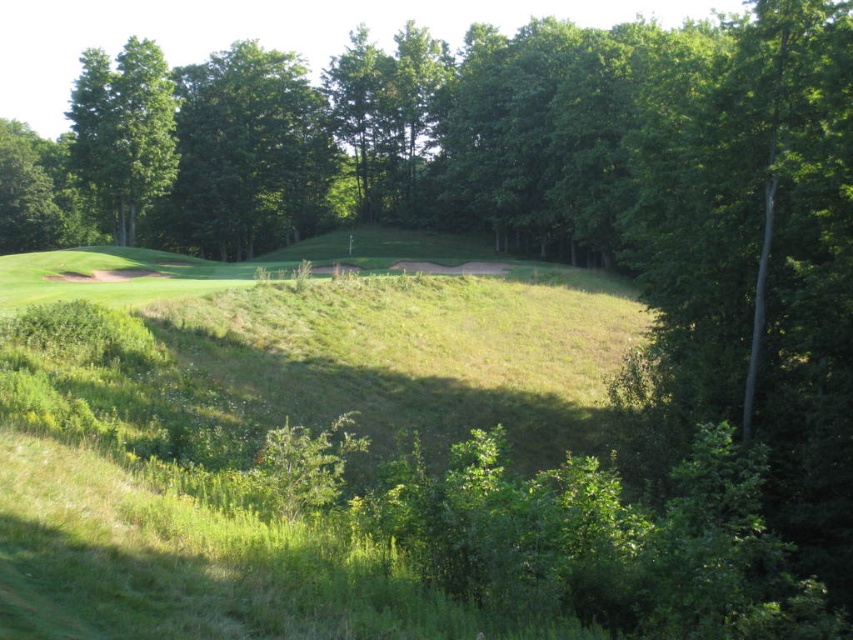
Based on the photo, is the position of green leafy tree at upper center more distant than that of green leafy tree at upper left?

That is True.

Who is higher up, green leafy tree at upper center or green leafy tree at upper left?

green leafy tree at upper left

Is point (242, 182) farther from camera compared to point (129, 205)?

That is True.

Where is `green leafy tree at upper center`? This screenshot has height=640, width=853. green leafy tree at upper center is located at coordinates (248, 156).